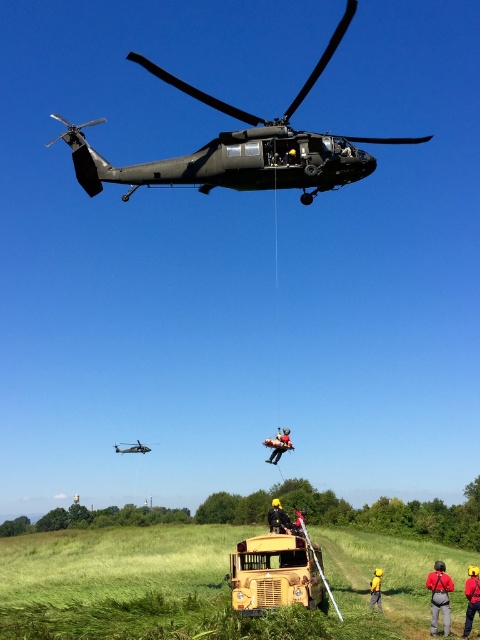
Is yellow matte school bus at center wider than yellow hard hat at center?

Yes, yellow matte school bus at center is wider than yellow hard hat at center.

You are a GUI agent. You are given a task and a screenshot of the screen. Output one action in this format:
    pyautogui.click(x=<x>, y=<y>)
    Task: Click on the yellow matte school bus at center
    This screenshot has height=640, width=480.
    Given the screenshot: What is the action you would take?
    (276, 573)

Does yellow fabric helmet at center appear under yellow fabric person at lower right?

Correct, yellow fabric helmet at center is located below yellow fabric person at lower right.

Does yellow fabric helmet at center have a larger size compared to yellow fabric person at lower right?

Indeed, yellow fabric helmet at center has a larger size compared to yellow fabric person at lower right.

Does point (279, 524) come farther from viewer compared to point (372, 580)?

No.

Find the location of `yellow fabric helmet at center`. yellow fabric helmet at center is located at coordinates (277, 518).

Does yellow hard hat at center have a smaller size compared to orange fabric person at center?

Yes, yellow hard hat at center is smaller than orange fabric person at center.

In the scene shown: Which is more to the left, yellow hard hat at center or orange fabric person at center?

orange fabric person at center is more to the left.

The image size is (480, 640). Find the location of `yellow hard hat at center`. yellow hard hat at center is located at coordinates (471, 596).